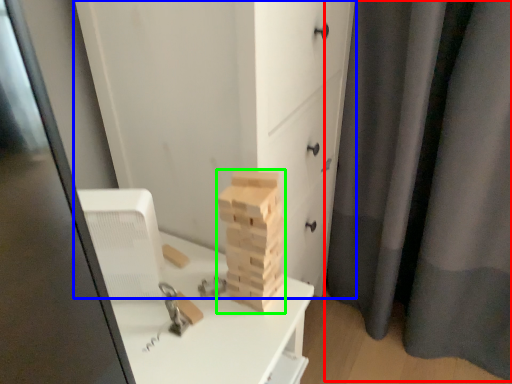
Question: Which object is positioned farthest from curtain (highlighted by a red box)? Select from chest of drawers (highlighted by a blue box) and drawer (highlighted by a green box).

Choices:
 (A) chest of drawers
 (B) drawer

Answer: (B)